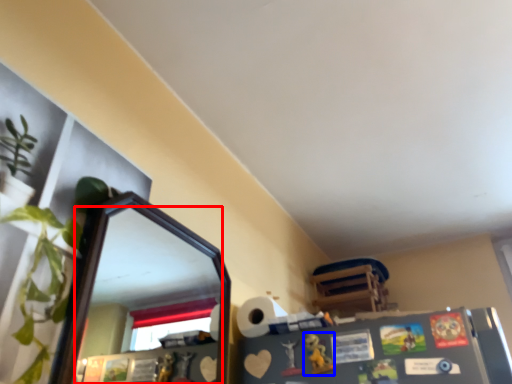
Question: Among these objects, which one is farthest to the camera, mirror (highlighted by a red box) or toy (highlighted by a blue box)?

Choices:
 (A) mirror
 (B) toy

Answer: (B)